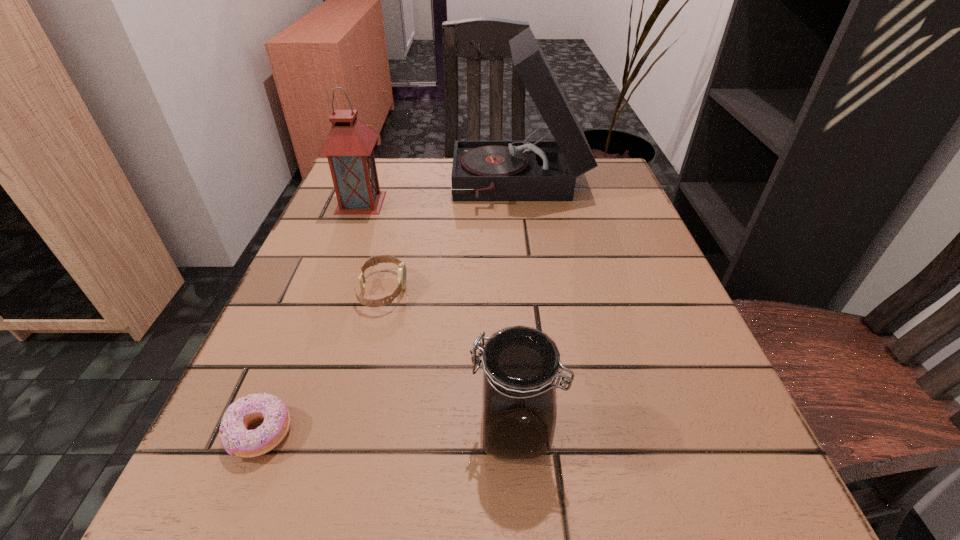
The height and width of the screenshot is (540, 960). What are the coordinates of `vacant region between the jar and the tallest object` in the screenshot? It's located at (516, 308).

Image resolution: width=960 pixels, height=540 pixels. Find the location of `free space between the jar and the shortest object`. free space between the jar and the shortest object is located at coordinates (387, 432).

At what (x,y) coordinates should I click in order to perform the action: click on unoccupied position between the third tallest object and the second tallest object. Please return your answer as a coordinate pair (x, y). Image resolution: width=960 pixels, height=540 pixels. Looking at the image, I should click on (438, 317).

This screenshot has height=540, width=960. I want to click on unoccupied position between the lantern and the third farthest object, so click(372, 246).

Where is `free space between the fourth tallest object and the third tallest object`? free space between the fourth tallest object and the third tallest object is located at coordinates click(448, 360).

Image resolution: width=960 pixels, height=540 pixels. What are the coordinates of `vacant space that's between the lantern and the shortest object` in the screenshot? It's located at (311, 318).

Identify the location of unoccupied position between the jar and the watch. (448, 360).

Locate an element on the screen. free area in between the watch and the doughnut is located at coordinates (322, 361).

In order to click on object that can be found as the third closest to the lantern in this screenshot , I will do pos(236,439).

Image resolution: width=960 pixels, height=540 pixels. What are the coordinates of `the third closest object relative to the phonograph_record` in the screenshot? It's located at (520, 364).